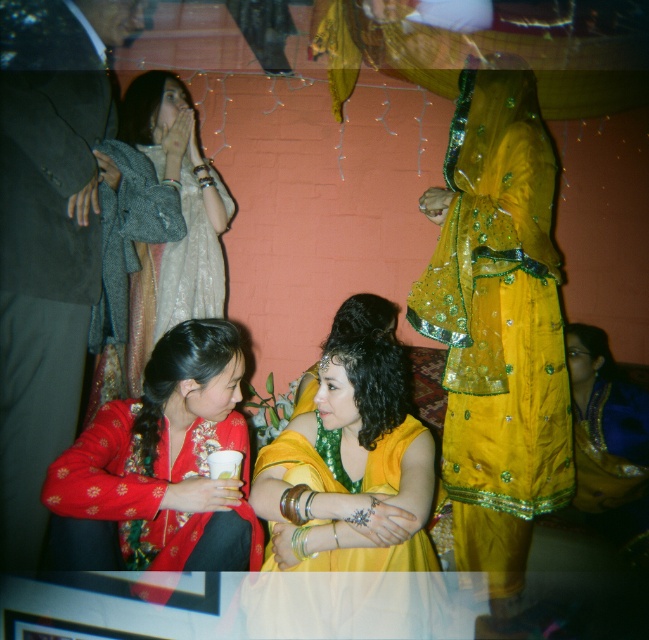
Can you confirm if shiny yellow sari at center is positioned above matte gray coat at upper left?

Incorrect, shiny yellow sari at center is not positioned above matte gray coat at upper left.

Which of these two, shiny yellow sari at center or matte gray coat at upper left, stands shorter?

Standing shorter between the two is shiny yellow sari at center.

This screenshot has height=640, width=649. What do you see at coordinates (350, 458) in the screenshot?
I see `shiny yellow sari at center` at bounding box center [350, 458].

This screenshot has height=640, width=649. In order to click on shiny yellow sari at center in this screenshot , I will do point(350,458).

Does shiny yellow sari at center have a larger size compared to matte red blouse at lower left?

Yes, shiny yellow sari at center is bigger than matte red blouse at lower left.

Who is lower down, shiny yellow sari at center or matte red blouse at lower left?

Positioned lower is matte red blouse at lower left.

This screenshot has width=649, height=640. Identify the location of shiny yellow sari at center. (350, 458).

Is shiny yellow dress at right to the left of matte red blouse at lower left from the viewer's perspective?

No, shiny yellow dress at right is not to the left of matte red blouse at lower left.

Does point (480, 392) come behind point (193, 392)?

Yes, point (480, 392) is behind point (193, 392).

At what (x,y) coordinates should I click in order to perform the action: click on shiny yellow dress at right. Please return your answer as a coordinate pair (x, y). The width and height of the screenshot is (649, 640). Looking at the image, I should click on (496, 324).